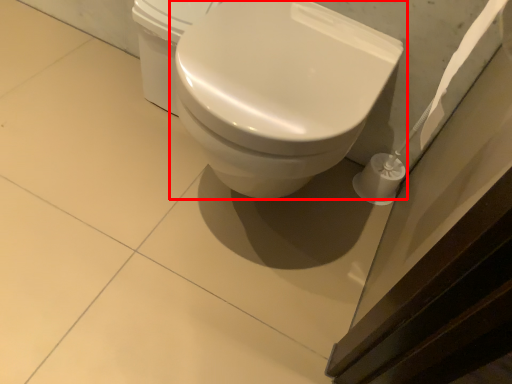
Question: From the image's perspective, considering the relative positions of toilet (annotated by the red box) and porcelain in the image provided, where is toilet (annotated by the red box) located with respect to the staircase?

Choices:
 (A) above
 (B) below

Answer: (B)